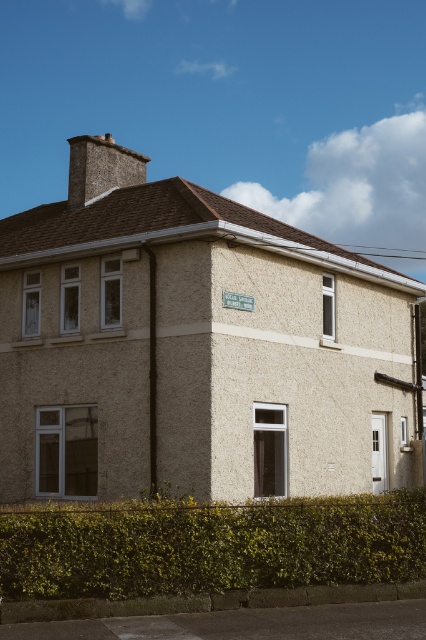
Is green leafy hedge at lower center positioned behind green plastic street sign at upper center?

No, it is not.

Who is taller, green leafy hedge at lower center or green plastic street sign at upper center?

green leafy hedge at lower center

Does point (117, 545) lie behind point (245, 300)?

No, it is not.

Identify the location of green leafy hedge at lower center. Image resolution: width=426 pixels, height=640 pixels. (209, 545).